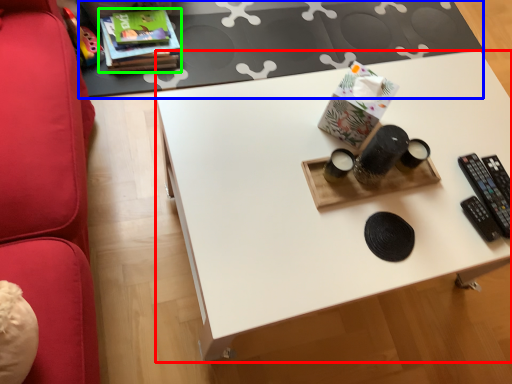
Question: Based on their relative distances, which object is nearer to desk (highlighted by a red box)? Choose from table (highlighted by a blue box) and book (highlighted by a green box).

Choices:
 (A) table
 (B) book

Answer: (A)